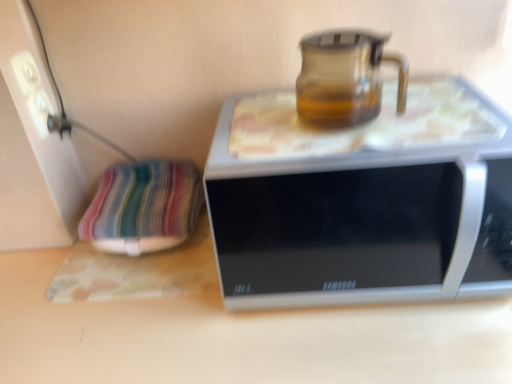
This screenshot has width=512, height=384. I want to click on vacant space situated above silver metallic microwave at center (from a real-world perspective), so click(x=350, y=128).